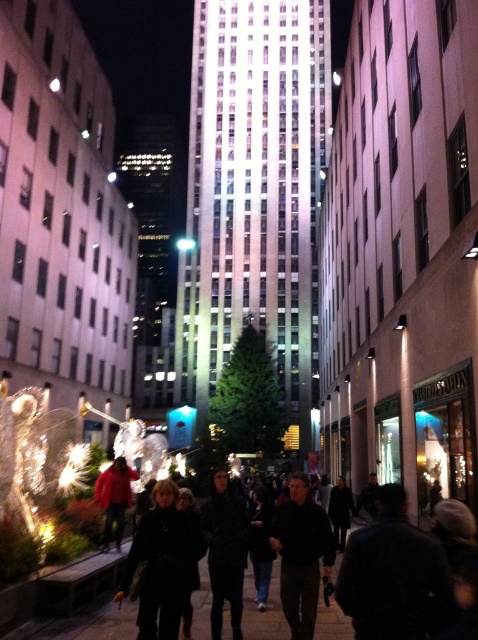
Question: Which point appears farthest from the camera in this image?

Choices:
 (A) (97, 490)
 (B) (162, 584)

Answer: (A)

Question: Estimate the real-world distances between objects in this image. Which object is closer to the black leather coat at center?

Choices:
 (A) red fabric coat at center
 (B) dark gray sweater at center

Answer: (B)

Question: Can you confirm if black matte crowd at center is smaller than red fabric coat at center?

Choices:
 (A) no
 (B) yes

Answer: (A)

Question: Does black leather coat at center appear under black matte crowd at center?

Choices:
 (A) no
 (B) yes

Answer: (B)

Question: Which object appears closest to the camera in this image?

Choices:
 (A) dark gray sweater at center
 (B) red fabric coat at center
 (C) black leather coat at center
 (D) black matte crowd at center

Answer: (D)

Question: Can you confirm if black matte crowd at center is thinner than red fabric coat at center?

Choices:
 (A) no
 (B) yes

Answer: (A)